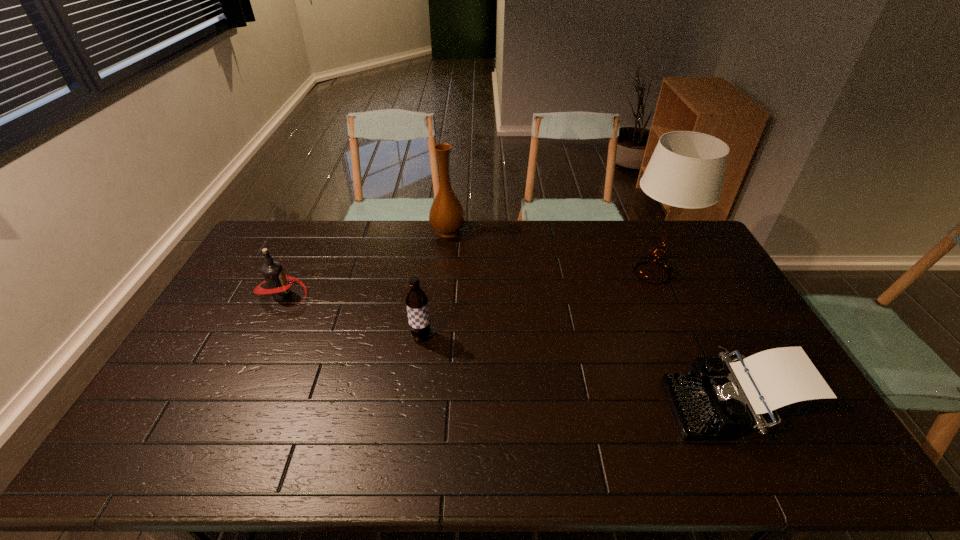
The height and width of the screenshot is (540, 960). I want to click on vacant area that lies between the farthest object and the nearest object, so click(x=588, y=319).

The height and width of the screenshot is (540, 960). In order to click on object that ranks as the fourth closest to the nearest object in this screenshot , I will do `click(277, 281)`.

Point out which object is positioned as the nearest to the farthest object. Please provide its 2D coordinates. Your answer should be formatted as a tuple, i.e. [(x, y)], where the tuple contains the x and y coordinates of a point satisfying the conditions above.

[(277, 281)]

You are a GUI agent. You are given a task and a screenshot of the screen. Output one action in this format:
    pyautogui.click(x=<x>, y=<y>)
    Task: Click on the vacant area that satisfies the following two spatial constraints: 1. on the label of the left root beer; 2. on the right side of the nearer root beer
    The image size is (960, 540).
    Given the screenshot: What is the action you would take?
    pyautogui.click(x=263, y=336)

You are a GUI agent. You are given a task and a screenshot of the screen. Output one action in this format:
    pyautogui.click(x=<x>, y=<y>)
    Task: Click on the free spot that satisfies the following two spatial constraints: 1. on the back side of the taller root beer; 2. on the label of the shorter root beer
    The height and width of the screenshot is (540, 960).
    Given the screenshot: What is the action you would take?
    pyautogui.click(x=426, y=295)